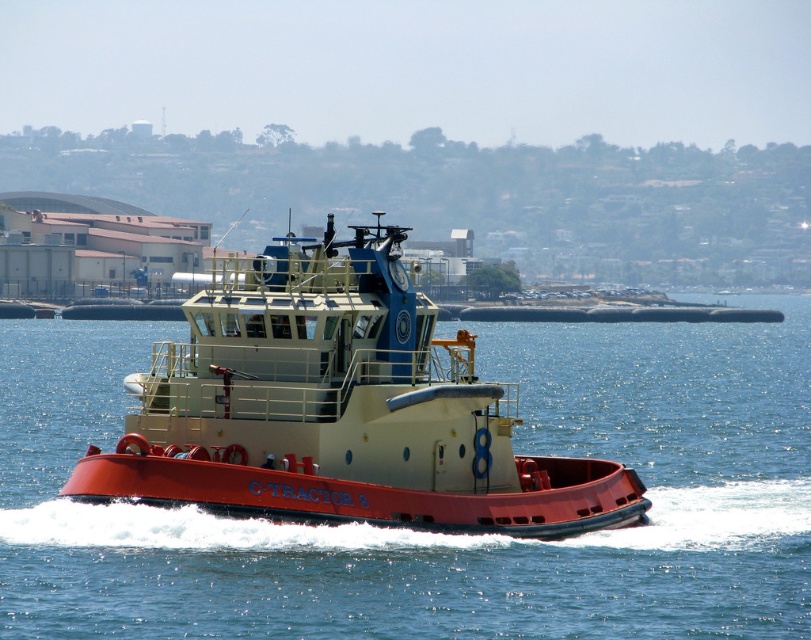
You are an observer standing on the shore looking at the red matte water at center and the red matte tugboat at center. Which object appears taller from your perspective?

The red matte water at center appears taller than the red matte tugboat at center from your perspective.

You are a marine biologist observing the scene from a helicopter above the water. You need to determine if a 100 feet long research vessel can safely pass between the red matte water at center and the red matte tugboat at center without any risk of collision. Can it?

The distance between the red matte water at center and the red matte tugboat at center is 82.48 feet. Since the research vessel is 100 feet long, it cannot safely pass through the 82.48 feet gap as the vessel is longer than the available space.